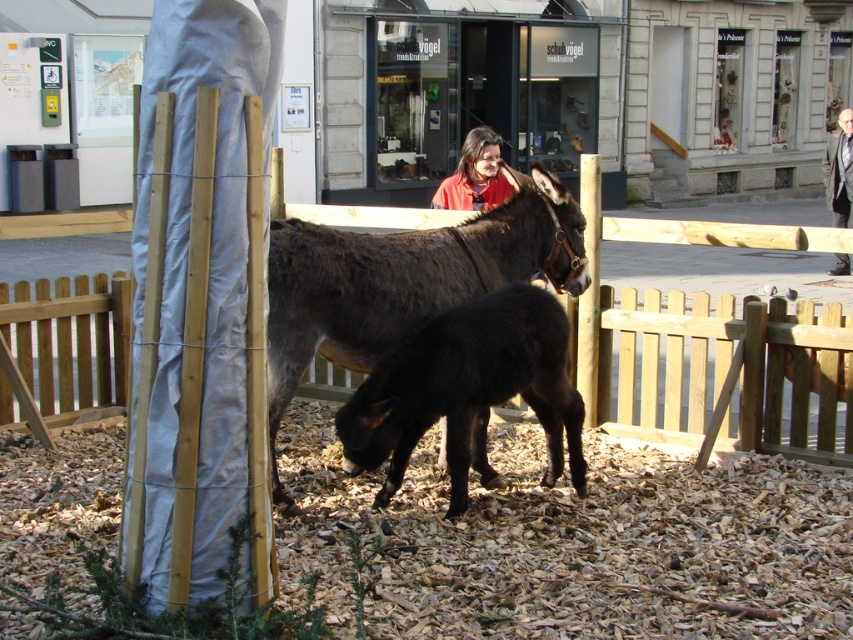
You are standing outside the enclosure and want to approach the smaller donkey without entering the fenced area. Which direction should you move relative to the wooden fence at center to get closer to the smaller donkey?

The wooden fence at center is located at point (664, 362). Since the smaller donkey is positioned closer to the center of the image, you should move towards the center area near the wooden fence at center to get closer to the smaller donkey without entering the fenced enclosure.

You are a visitor at the farm and want to take a photo of the wooden fence at center and the dark brown glossy donkey at center. Which one should you focus on first if you want to capture both in the same frame?

The wooden fence at center is below dark brown glossy donkey at center, so you should focus on the wooden fence at center first to ensure both are in focus.